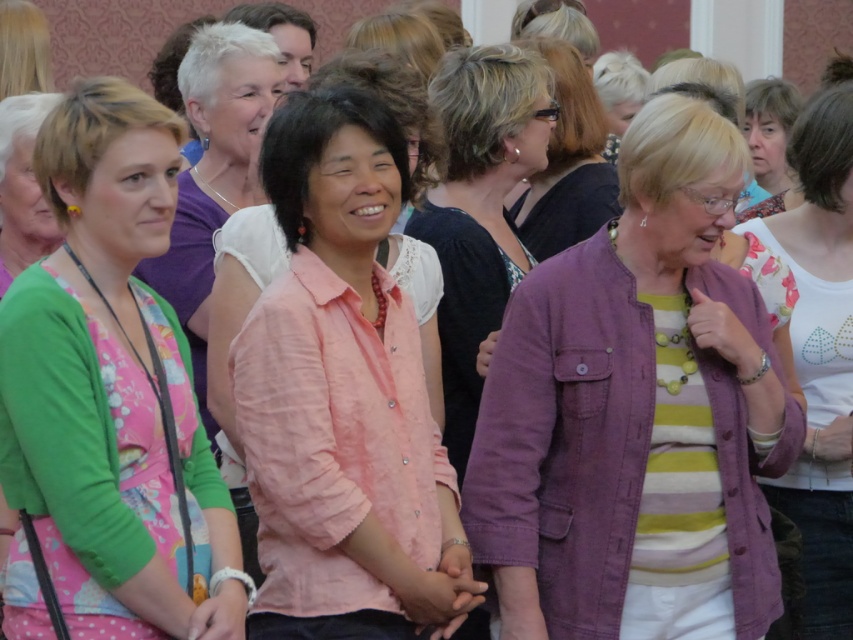
Between purple cotton jacket at center and black matte shirt at center, which one has less height?

With less height is black matte shirt at center.

Between purple cotton jacket at center and black matte shirt at center, which one is positioned lower?

purple cotton jacket at center is below.

You are a GUI agent. You are given a task and a screenshot of the screen. Output one action in this format:
    pyautogui.click(x=<x>, y=<y>)
    Task: Click on the purple cotton jacket at center
    Image resolution: width=853 pixels, height=640 pixels.
    Given the screenshot: What is the action you would take?
    (x=635, y=410)

Is point (59, 600) in front of point (189, 195)?

Yes, point (59, 600) is in front of point (189, 195).

Locate an element on the screen. Image resolution: width=853 pixels, height=640 pixels. green floral dress at left is located at coordinates (112, 387).

Is striped knit sweater at center below matte pink blouse at center?

No, striped knit sweater at center is not below matte pink blouse at center.

Does striped knit sweater at center come behind matte pink blouse at center?

Yes, striped knit sweater at center is further from the viewer.

Is point (792, 244) less distant than point (486, 186)?

Yes, point (792, 244) is in front of point (486, 186).

Where is `striped knit sweater at center`? The image size is (853, 640). striped knit sweater at center is located at coordinates (820, 353).